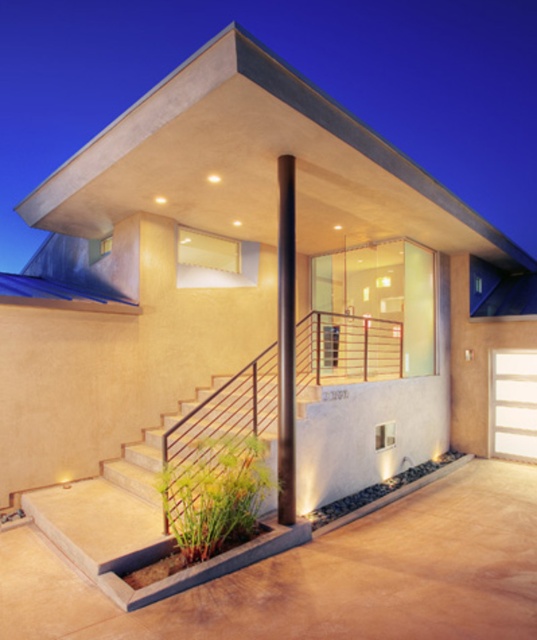
Question: Which object is positioned farthest from the black polished pole at center?

Choices:
 (A) smooth concrete stairs at center
 (B) white wood garage door at center

Answer: (B)

Question: Is smooth concrete wall at center positioned at the back of smooth concrete stairs at center?

Choices:
 (A) yes
 (B) no

Answer: (B)

Question: Does smooth concrete wall at center appear over white wood garage door at center?

Choices:
 (A) yes
 (B) no

Answer: (A)

Question: Which object appears farthest from the camera in this image?

Choices:
 (A) smooth concrete stairs at center
 (B) white wood garage door at center
 (C) smooth concrete wall at center

Answer: (B)

Question: Is smooth concrete wall at center smaller than black polished pole at center?

Choices:
 (A) yes
 (B) no

Answer: (B)

Question: Which point appears closest to the camera in this image?

Choices:
 (A) (514, 444)
 (B) (92, 554)
 (C) (294, 12)

Answer: (B)